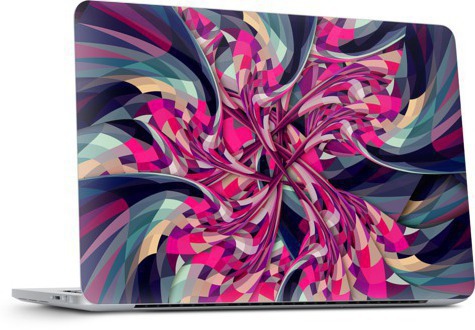
Find the location of a particular element. The width and height of the screenshot is (475, 330). laptop is located at coordinates (181, 80).